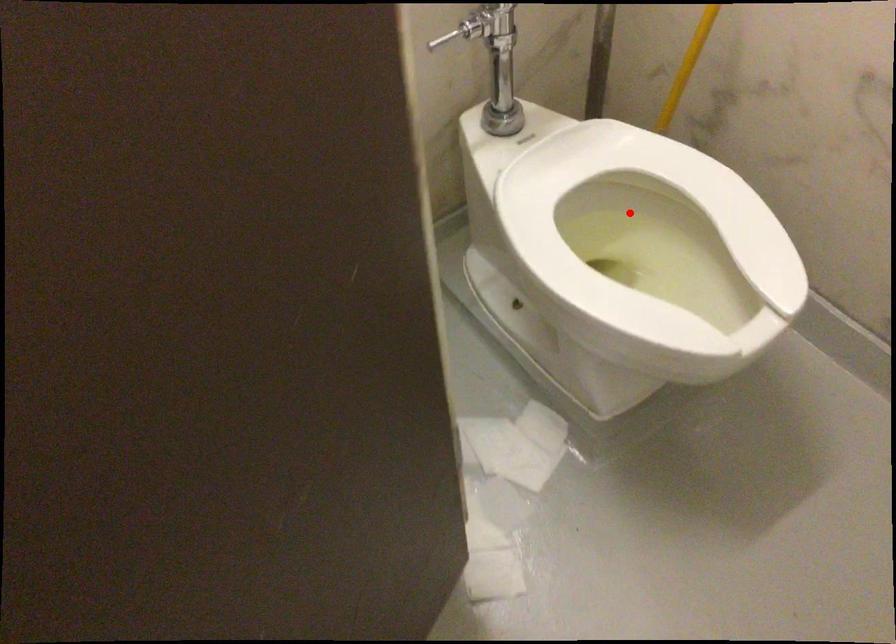
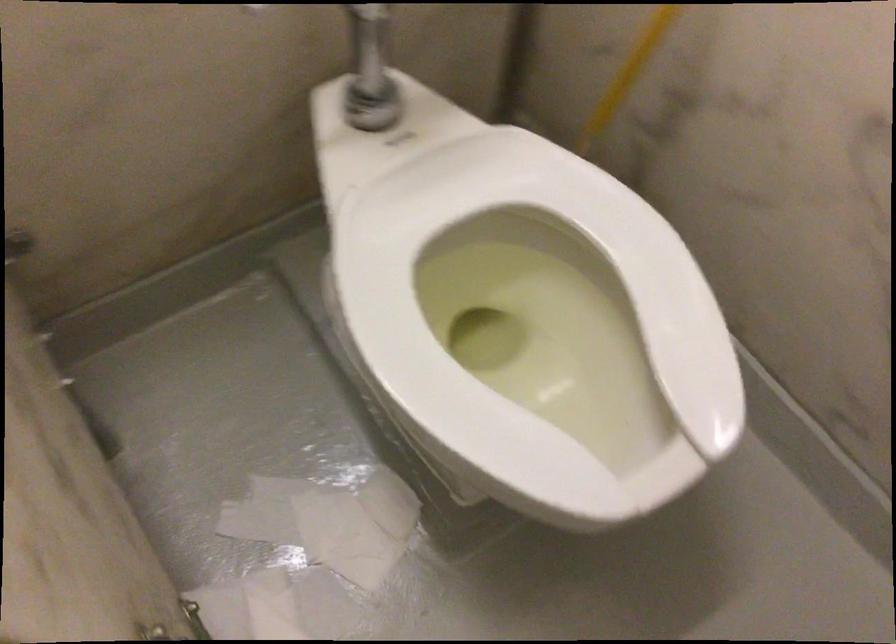
The point at the highlighted location is marked in the first image. Where is the corresponding point in the second image?

(536, 254)